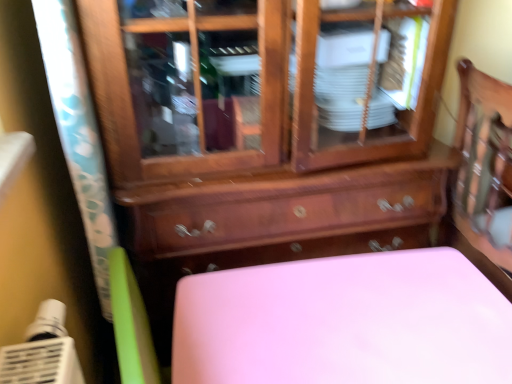
The height and width of the screenshot is (384, 512). What do you see at coordinates (265, 133) in the screenshot?
I see `wooden cabinet at center` at bounding box center [265, 133].

In order to click on wooden cabinet at center in this screenshot , I will do `click(265, 133)`.

I want to click on pink matte table at lower center, so click(x=344, y=322).

What do you see at coordinates (344, 322) in the screenshot? I see `pink matte table at lower center` at bounding box center [344, 322].

Find the location of a particular element. wooden cabinet at center is located at coordinates (265, 133).

Is wooden cabinet at center to the left of pink matte table at lower center from the viewer's perspective?

Indeed, wooden cabinet at center is positioned on the left side of pink matte table at lower center.

Considering the positions of objects wooden cabinet at center and pink matte table at lower center in the image provided, who is behind, wooden cabinet at center or pink matte table at lower center?

pink matte table at lower center is more distant.

Is point (434, 183) closer to camera compared to point (234, 325)?

No, it is behind (234, 325).

From the image's perspective, who appears lower, wooden cabinet at center or pink matte table at lower center?

pink matte table at lower center.

From a real-world perspective, which object rests below the other?

pink matte table at lower center.

In terms of width, does wooden cabinet at center look wider or thinner when compared to pink matte table at lower center?

Considering their sizes, wooden cabinet at center looks broader than pink matte table at lower center.

Which of these two, wooden cabinet at center or pink matte table at lower center, stands taller?

With more height is wooden cabinet at center.

Considering the sizes of objects wooden cabinet at center and pink matte table at lower center in the image provided, who is bigger, wooden cabinet at center or pink matte table at lower center?

wooden cabinet at center is bigger.

Is wooden cabinet at center surrounding pink matte table at lower center?

No, wooden cabinet at center does not contain pink matte table at lower center.

Is the surface of wooden cabinet at center in direct contact with pink matte table at lower center?

They are not placed beside each other.

Could you tell me if wooden cabinet at center is turned towards pink matte table at lower center?

Yes, wooden cabinet at center is oriented towards pink matte table at lower center.

How distant is wooden cabinet at center from pink matte table at lower center?

A distance of 12.41 inches exists between wooden cabinet at center and pink matte table at lower center.

Locate an element on the screen. furniture below the wooden cabinet at center (from a real-world perspective) is located at coordinates (344, 322).

Is pink matte table at lower center to the left of wooden cabinet at center from the viewer's perspective?

Incorrect, pink matte table at lower center is not on the left side of wooden cabinet at center.

Which is behind, pink matte table at lower center or wooden cabinet at center?

pink matte table at lower center is behind.

Considering the points (396, 294) and (407, 167), which point is behind, point (396, 294) or point (407, 167)?

The point (407, 167) is farther.

From the image's perspective, which one is positioned higher, pink matte table at lower center or wooden cabinet at center?

wooden cabinet at center, from the image's perspective.

Consider the image. From a real-world perspective, which object stands above the other?

In real-world perspective, wooden cabinet at center is above.

Considering the sizes of pink matte table at lower center and wooden cabinet at center in the image, is pink matte table at lower center wider or thinner than wooden cabinet at center?

In the image, pink matte table at lower center appears to be more narrow than wooden cabinet at center.

Does pink matte table at lower center have a lesser height compared to wooden cabinet at center?

Correct, pink matte table at lower center is not as tall as wooden cabinet at center.

Can you confirm if pink matte table at lower center is bigger than wooden cabinet at center?

No, pink matte table at lower center is not bigger than wooden cabinet at center.

Is pink matte table at lower center completely or partially outside of wooden cabinet at center?

Yes, pink matte table at lower center is outside of wooden cabinet at center.

Does pink matte table at lower center touch wooden cabinet at center?

No, pink matte table at lower center is not making contact with wooden cabinet at center.

Could you tell me if pink matte table at lower center is turned towards wooden cabinet at center?

No.

How many degrees apart are the facing directions of pink matte table at lower center and wooden cabinet at center?

There is a 1.84-degree angle between the facing directions of pink matte table at lower center and wooden cabinet at center.

Where is `the chest of drawers above the pink matte table at lower center (from a real-world perspective)`? the chest of drawers above the pink matte table at lower center (from a real-world perspective) is located at coordinates coord(265,133).

The width and height of the screenshot is (512, 384). In the image, there is a pink matte table at lower center. In order to click on the chest of drawers above it (from the image's perspective) in this screenshot , I will do `click(265, 133)`.

Image resolution: width=512 pixels, height=384 pixels. What are the coordinates of `furniture located behind the wooden cabinet at center` in the screenshot? It's located at (344, 322).